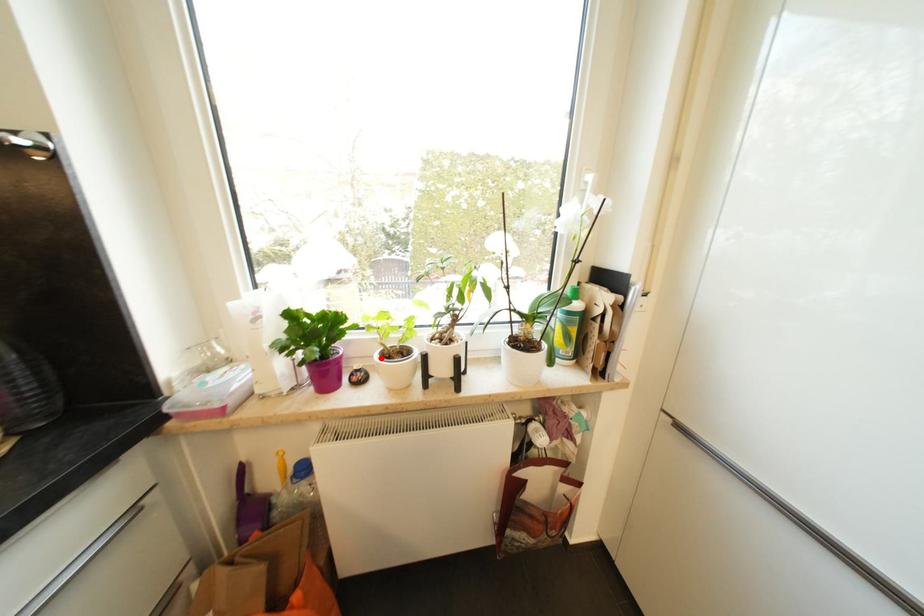
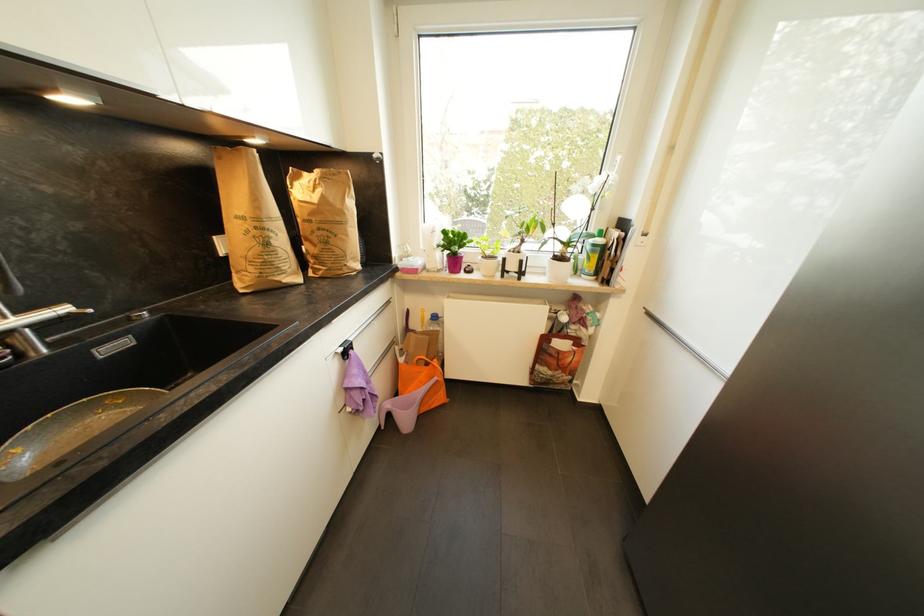
Question: I am providing you with two images of the same scene from different viewpoints. Given a red point in image1, look at the same physical point in image2. Is it:

Choices:
 (A) Closer to the viewpoint
 (B) Farther from the viewpoint

Answer: (A)